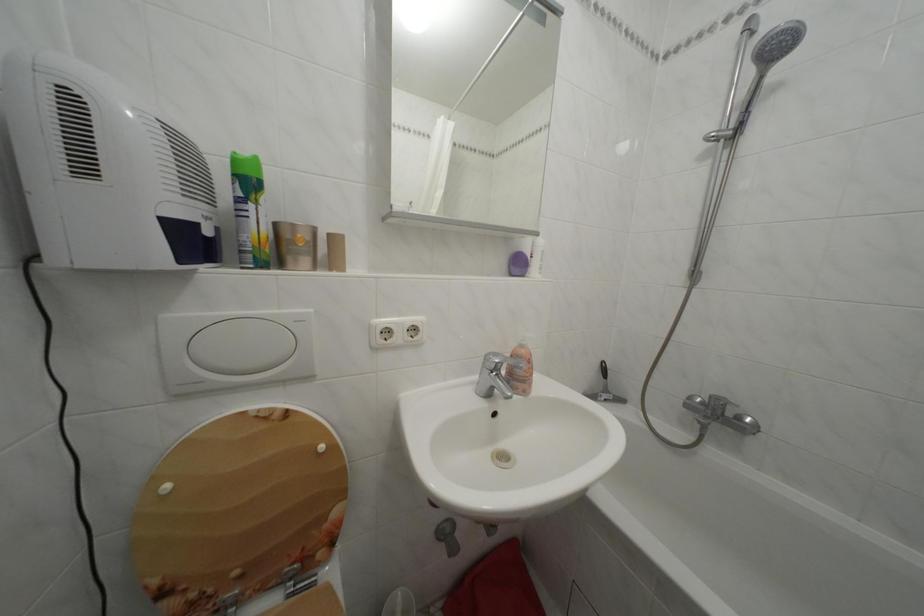
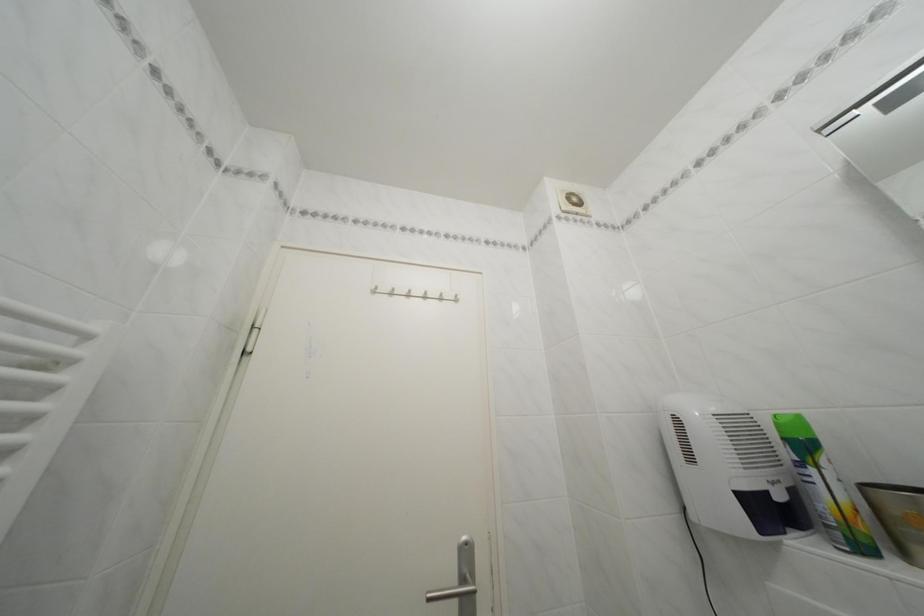
Where in the second image is the point corresponding to point (242, 182) from the first image?

(793, 445)